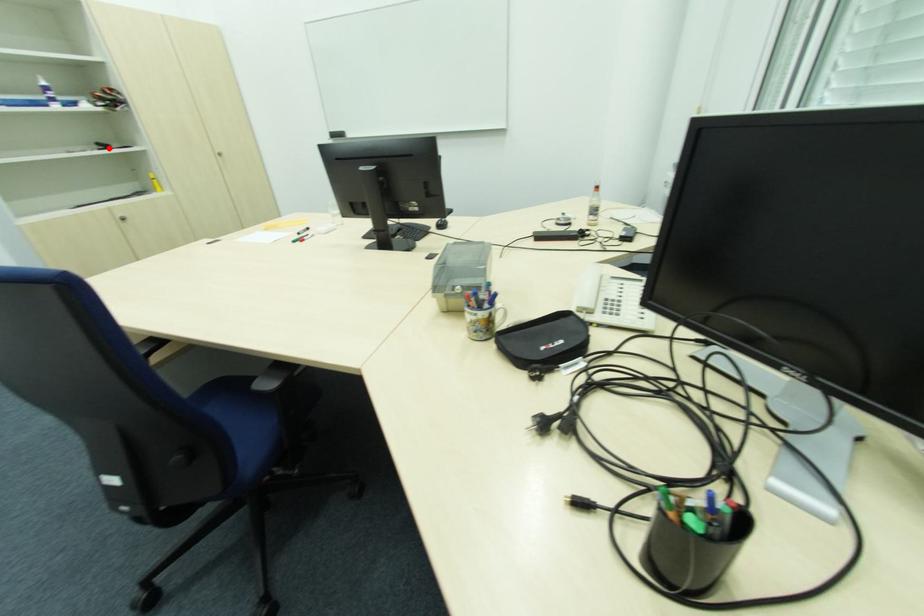
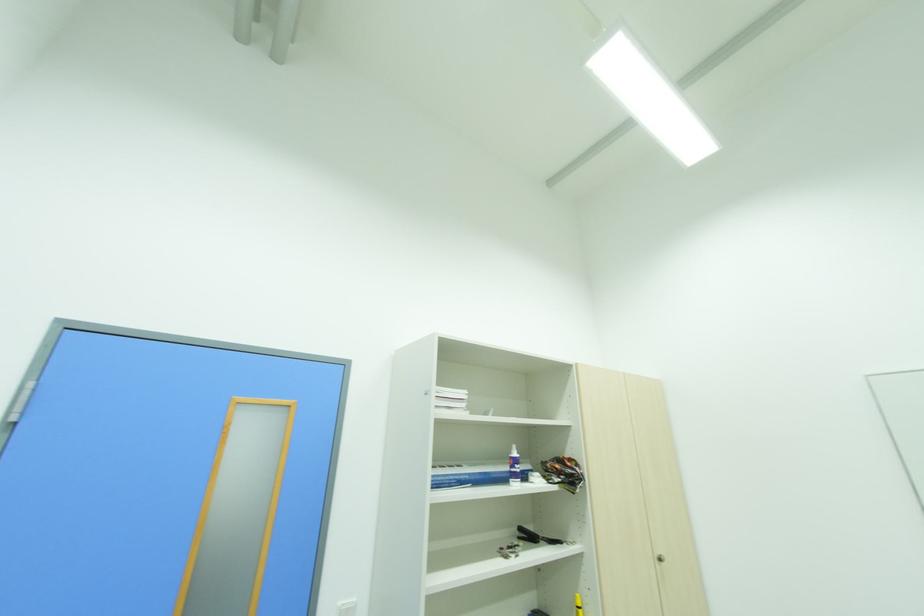
Where in the second image is the point corresponding to the highlighted location from the first image?

(536, 539)